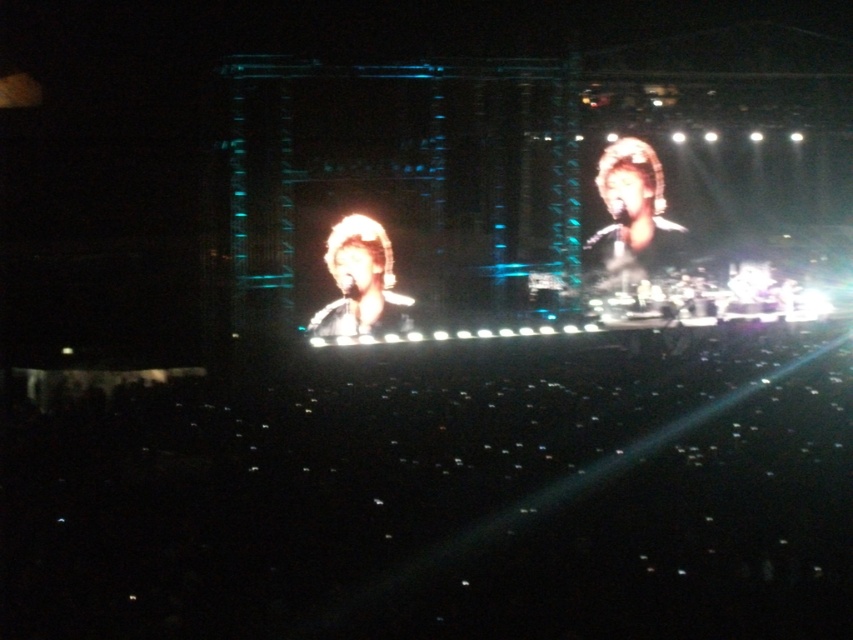
Question: Is shiny black microphone at center to the right of shiny gold headband at upper right from the viewer's perspective?

Choices:
 (A) no
 (B) yes

Answer: (A)

Question: Is shiny black microphone at center below shiny gold headband at upper right?

Choices:
 (A) yes
 (B) no

Answer: (A)

Question: Can you confirm if shiny black microphone at center is positioned to the right of shiny gold headband at upper right?

Choices:
 (A) no
 (B) yes

Answer: (A)